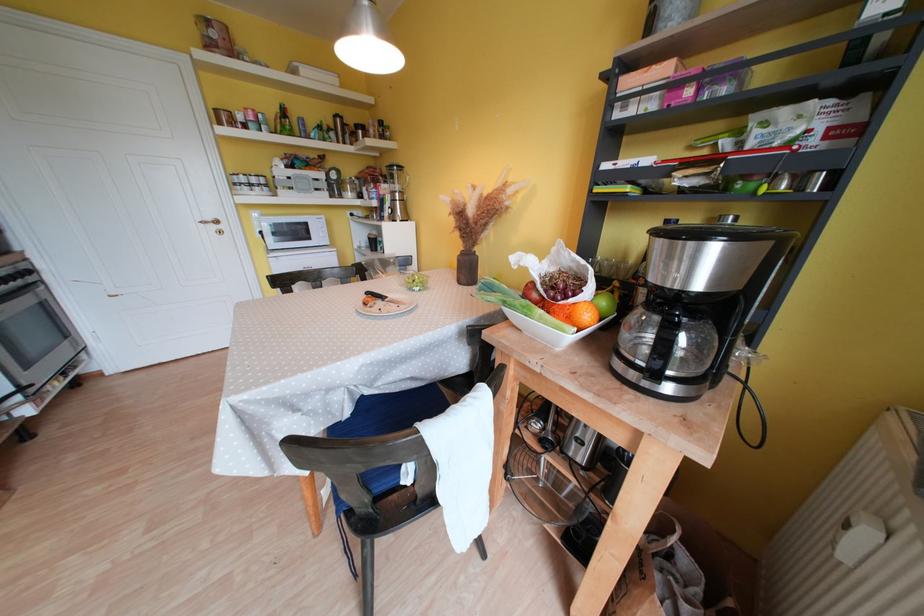
Locate an element on the screen. black handle knife is located at coordinates (383, 298).